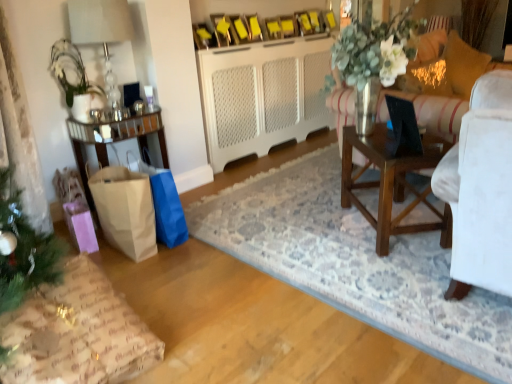
Where is `vacant space in front of brown wooden table at center, which ranks as the 1th table in right-to-left order`? Image resolution: width=512 pixels, height=384 pixels. vacant space in front of brown wooden table at center, which ranks as the 1th table in right-to-left order is located at coordinates (413, 275).